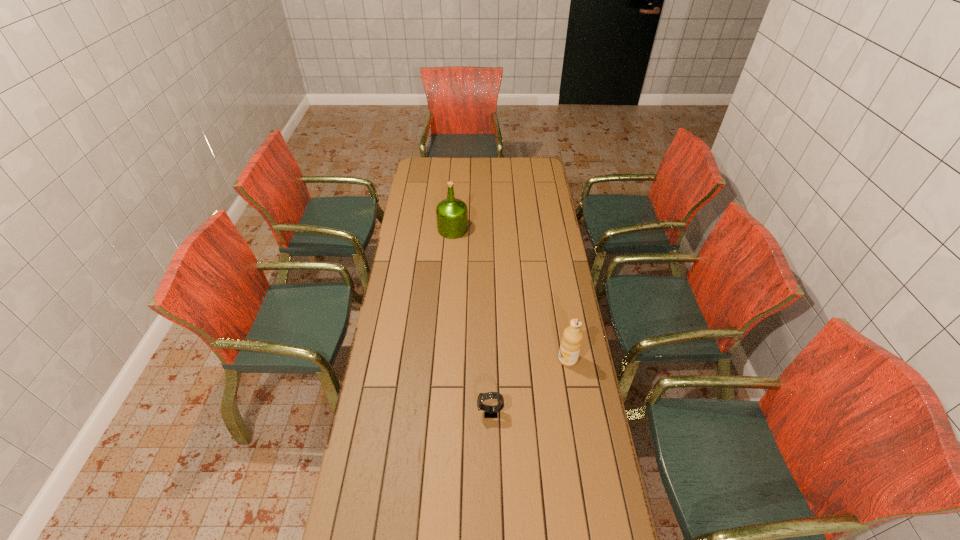
Locate an element on the screen. vacant position located 0.260m on the face of the watch is located at coordinates (401, 413).

Identify the location of vacant area situated 0.060m on the face of the watch. (460, 413).

This screenshot has width=960, height=540. Find the location of `free space located 0.250m on the face of the watch`. free space located 0.250m on the face of the watch is located at coordinates (404, 413).

What are the coordinates of `object at the right edge` in the screenshot? It's located at (571, 342).

This screenshot has height=540, width=960. Identify the location of free region at the far edge of the desktop. click(456, 161).

Locate an element on the screen. The height and width of the screenshot is (540, 960). vacant space at the left edge is located at coordinates (418, 334).

I want to click on vacant space at the right edge of the desktop, so click(598, 500).

I want to click on vacant space at the far left corner of the desktop, so pos(414,160).

Locate an element on the screen. This screenshot has height=540, width=960. free spot between the rightmost object and the nearest object is located at coordinates (529, 386).

Locate an element on the screen. unoccupied area between the watch and the second tallest object is located at coordinates (529, 386).